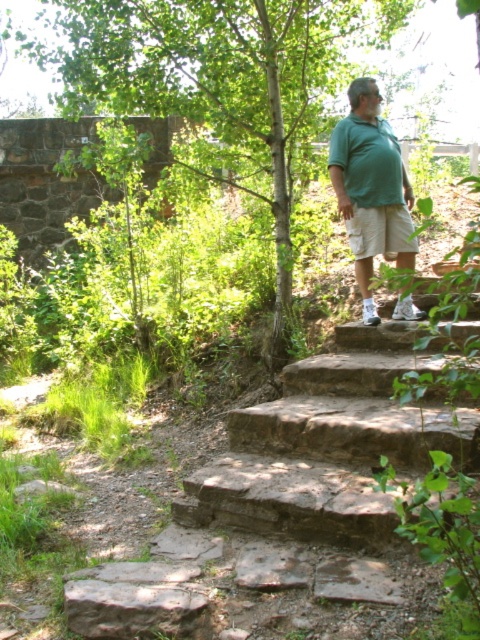
Question: Is green leafy tree at upper center wider than brown stone stairs at upper center?

Choices:
 (A) yes
 (B) no

Answer: (A)

Question: Which object is the closest to the green leafy tree at upper center?

Choices:
 (A) brown stone stairs at upper center
 (B) green cotton shirt at upper right

Answer: (B)

Question: Which object is positioned farthest from the brown stone stairs at upper center?

Choices:
 (A) green cotton shirt at upper right
 (B) brown rough stone at lower left
 (C) green leafy tree at upper center

Answer: (C)

Question: Estimate the real-world distances between objects in this image. Which object is farther from the brown rough stone at lower left?

Choices:
 (A) green cotton shirt at upper right
 (B) green leafy tree at upper center
 (C) brown stone stairs at upper center

Answer: (B)

Question: Observing the image, what is the correct spatial positioning of green cotton shirt at upper right in reference to brown rough stone at lower left?

Choices:
 (A) right
 (B) left

Answer: (A)

Question: Can you confirm if green leafy tree at upper center is positioned to the left of green cotton shirt at upper right?

Choices:
 (A) no
 (B) yes

Answer: (B)